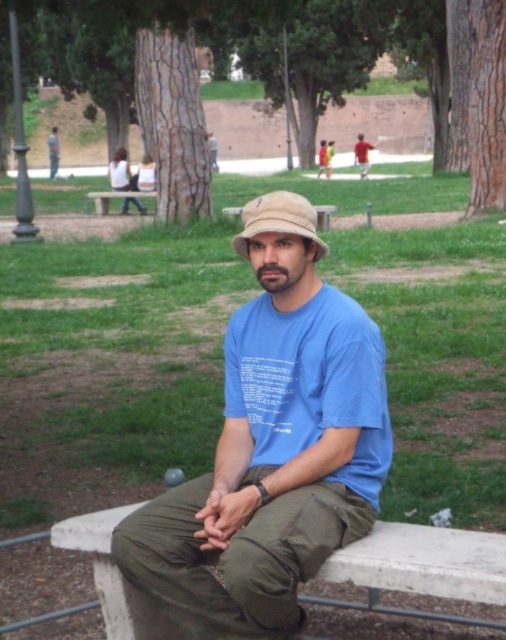
From the picture: You are planning to take a photo of the green bark tree at center and the rough bark tree at upper center. Which tree should you focus on if you want to capture the larger one in your shot?

The green bark tree at center is bigger than the rough bark tree at upper center, so you should focus on the green bark tree at center to capture the larger one in your shot.

You are a park visitor trying to locate the green bark tree at center. According to the scene, where is it positioned relative to the rough bark tree at upper center?

The green bark tree at center is located above the rough bark tree at upper center.

In the scene shown: You are a photographer setting up a tripod to capture the man in the park. You notice the beige fabric hat at center and the matte black shirt at center. Which object should you focus on first if you want to ensure both are in sharp focus, considering their positions?

The beige fabric hat at center is below matte black shirt at center, so you should focus on the matte black shirt at center first as it is closer to the camera.